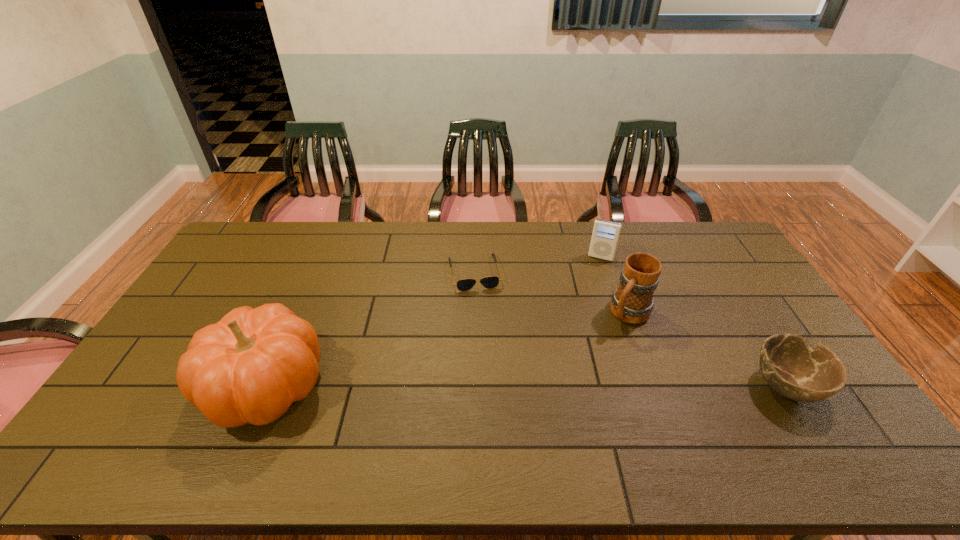
Locate an element on the screen. This screenshot has width=960, height=540. vacant point located between the third tallest object and the leftmost object is located at coordinates (433, 321).

Locate an element on the screen. The width and height of the screenshot is (960, 540). vacant point located between the third tallest object and the second shortest object is located at coordinates (694, 321).

The image size is (960, 540). Identify the location of blank region between the tallest object and the iPod. (433, 321).

The width and height of the screenshot is (960, 540). Find the location of `vacant area that lies between the rightmost object and the third tallest object`. vacant area that lies between the rightmost object and the third tallest object is located at coordinates (694, 321).

The height and width of the screenshot is (540, 960). What are the coordinates of `empty space between the third tallest object and the shortest object` in the screenshot? It's located at (538, 265).

This screenshot has height=540, width=960. Identify the location of free space between the mug and the fourth object from right to left. (552, 293).

Where is `vacant space in between the mug and the pumpkin`? vacant space in between the mug and the pumpkin is located at coordinates (447, 349).

Find the location of a particular element. free point between the mug and the second object from left to right is located at coordinates (552, 293).

Image resolution: width=960 pixels, height=540 pixels. Find the location of `vacant region between the fourth object from right to left and the mug`. vacant region between the fourth object from right to left and the mug is located at coordinates (552, 293).

Image resolution: width=960 pixels, height=540 pixels. I want to click on object that is the third closest to the iPod, so click(790, 366).